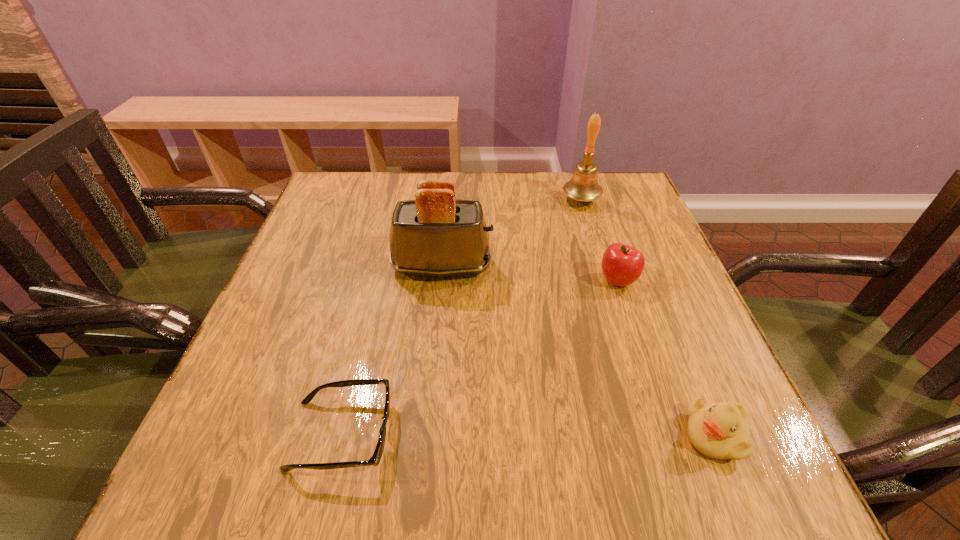
Where is `object located in the far right corner section of the desktop`? Image resolution: width=960 pixels, height=540 pixels. object located in the far right corner section of the desktop is located at coordinates (583, 186).

I want to click on object present at the near right corner, so click(x=721, y=431).

Where is `vacant space at the far edge of the desktop`? vacant space at the far edge of the desktop is located at coordinates (561, 183).

Image resolution: width=960 pixels, height=540 pixels. I want to click on vacant space at the near edge of the desktop, so click(x=489, y=468).

The width and height of the screenshot is (960, 540). I want to click on vacant region at the left edge of the desktop, so click(251, 341).

In the image, there is a desktop. Identify the location of vacant space at the right edge. (664, 388).

Where is `vacant area at the far left corner of the desktop`? vacant area at the far left corner of the desktop is located at coordinates (387, 173).

Where is `free region at the far right corner`? free region at the far right corner is located at coordinates (627, 218).

The image size is (960, 540). In order to click on free spot at the near right corner of the desktop in this screenshot , I will do `click(750, 467)`.

Find the location of a particular element. The height and width of the screenshot is (540, 960). vacant area that lies between the apple and the farthest object is located at coordinates (599, 240).